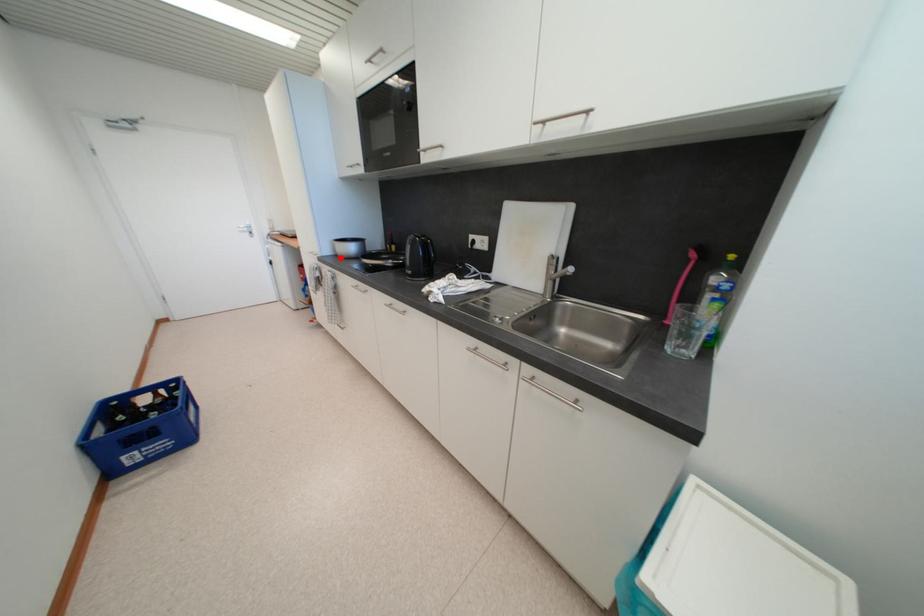
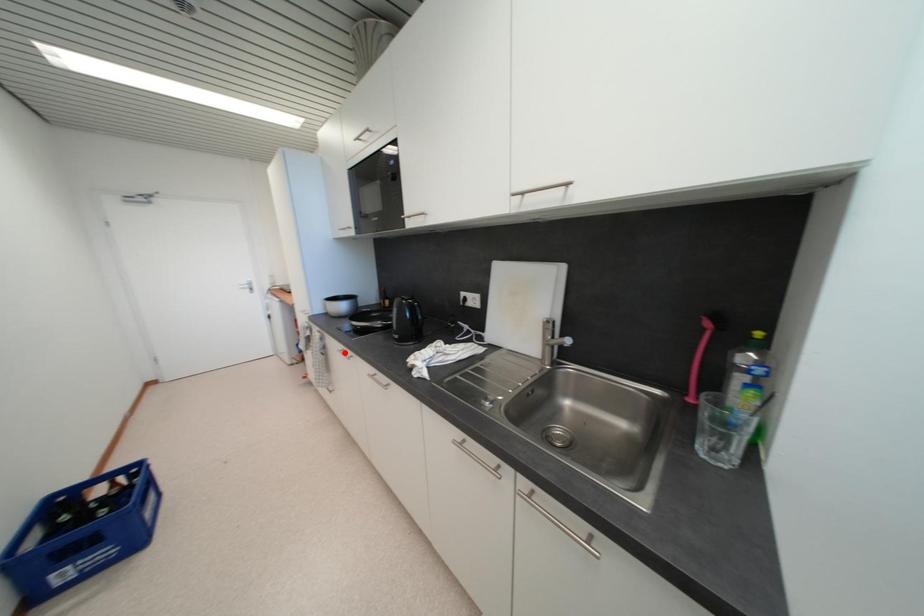
I am providing you with two images of the same scene from different viewpoints. A red point is marked on the first image and another point is marked on the second image. Do the highlighted points in image1 and image2 indicate the same real-world spot?

No